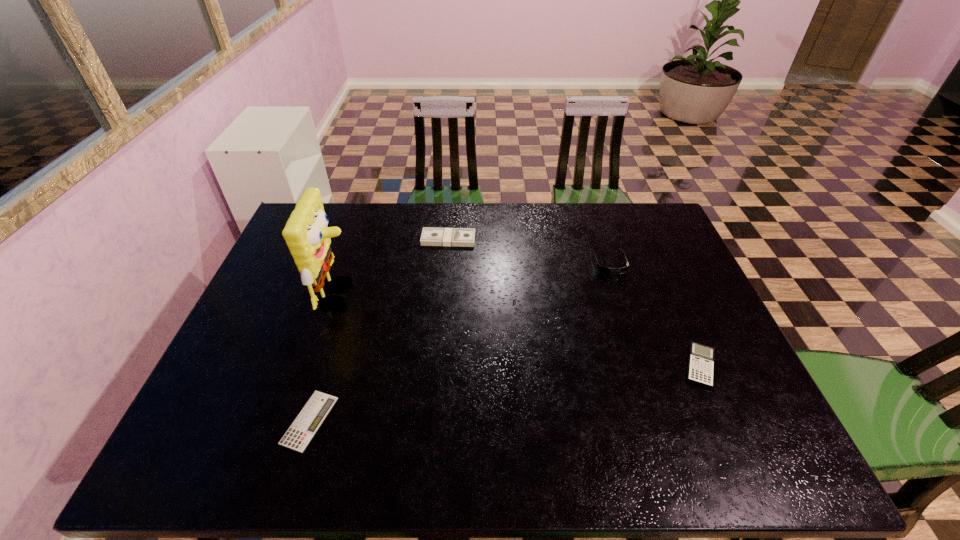
You are a GUI agent. You are given a task and a screenshot of the screen. Output one action in this format:
    pyautogui.click(x=<x>, y=<y>)
    Task: Click on the free spot located on the front-facing side of the sunglasses
    This screenshot has width=960, height=540.
    Given the screenshot: What is the action you would take?
    pyautogui.click(x=635, y=341)

Locate an element on the screen. free space located on the front of the dollar is located at coordinates (440, 343).

Identify the location of free space located on the left of the farther calculator. (554, 366).

You are a GUI agent. You are given a task and a screenshot of the screen. Output one action in this format:
    pyautogui.click(x=<x>, y=<y>)
    Task: Click on the vacant space located on the right of the nearer calculator
    
    Given the screenshot: What is the action you would take?
    pyautogui.click(x=456, y=421)

Identify the location of object positioned at the far edge. (461, 237).

You are a GUI agent. You are given a task and a screenshot of the screen. Output one action in this format:
    pyautogui.click(x=<x>, y=<y>)
    Task: Click on the object located at the near edge
    The width and height of the screenshot is (960, 540).
    Given the screenshot: What is the action you would take?
    pyautogui.click(x=301, y=432)

Locate an element on the screen. The image size is (960, 540). object positioned at the right edge is located at coordinates (701, 357).

What are the coordinates of `vacant area at the far edge of the desktop` in the screenshot? It's located at (543, 229).

Where is `vacant area at the near edge`? The image size is (960, 540). vacant area at the near edge is located at coordinates (527, 437).

In order to click on vacant space at the left edge of the desktop in this screenshot , I will do `click(286, 267)`.